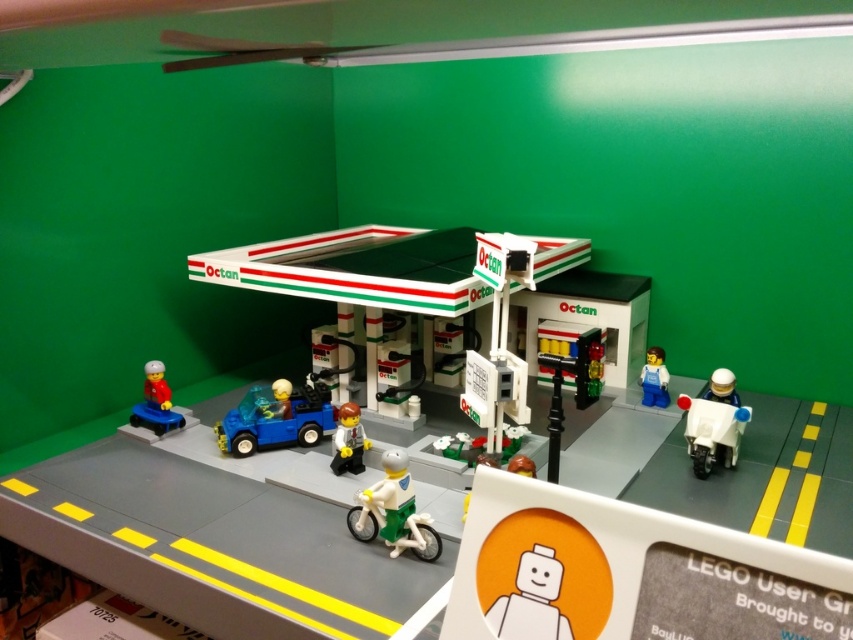
Question: Is white plastic motorcycle at lower right above matte red minifigure at left?

Choices:
 (A) no
 (B) yes

Answer: (A)

Question: Estimate the real-world distances between objects in this image. Which object is farther from the green plastic bicycle at center?

Choices:
 (A) blue plastic figure at center
 (B) matte red minifigure at left
 (C) white plastic motorcycle at lower right
 (D) white matte minifigure at center

Answer: (A)

Question: Which object appears farthest from the camera in this image?

Choices:
 (A) green plastic bicycle at center
 (B) white matte minifigure at center
 (C) white plastic motorcycle at lower right
 (D) matte red minifigure at left

Answer: (D)

Question: Is matte red minifigure at left smaller than blue plastic figure at center?

Choices:
 (A) yes
 (B) no

Answer: (B)

Question: Does white matte minifigure at center have a lesser width compared to smooth white minifigure at center?

Choices:
 (A) yes
 (B) no

Answer: (A)

Question: Which point appears farthest from the camera in this image?

Choices:
 (A) (386, 461)
 (B) (170, 412)
 (C) (689, 420)
 (D) (648, 376)

Answer: (D)